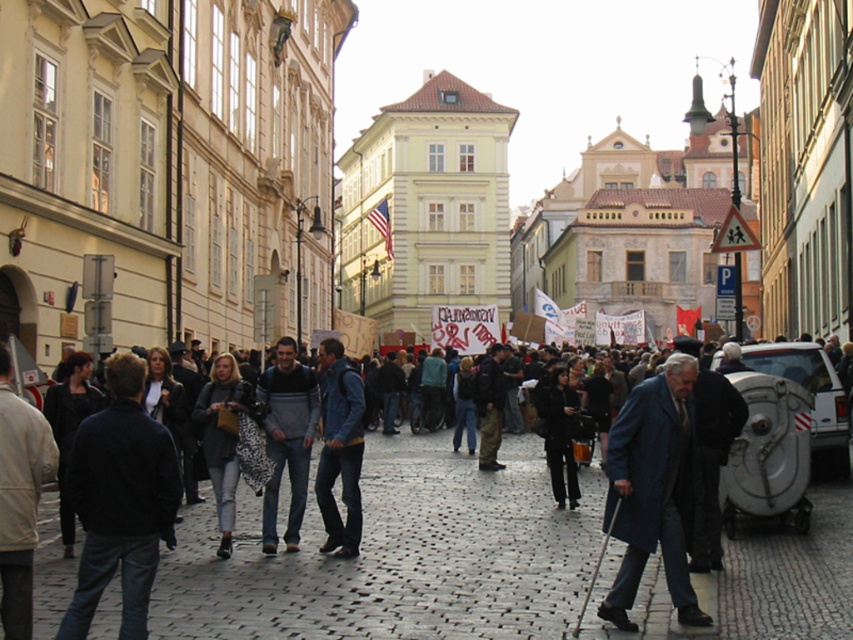
Question: Does knit sweater at center lie in front of leopard print coat at center?

Choices:
 (A) no
 (B) yes

Answer: (A)

Question: Which object appears closest to the camera in this image?

Choices:
 (A) black matte jacket at left
 (B) black fabric coat at center
 (C) cobblestone pavement at center
 (D) denim jacket at center

Answer: (C)

Question: Among these objects, which one is nearest to the camera?

Choices:
 (A) black matte jacket at left
 (B) light beige jacket at left
 (C) denim jacket at center
 (D) black fabric coat at center

Answer: (B)

Question: Does cobblestone pavement at center come in front of black matte jacket at left?

Choices:
 (A) yes
 (B) no

Answer: (A)

Question: Among these points, which one is farthest from the camera?

Choices:
 (A) (96, 573)
 (B) (784, 579)
 (C) (212, 429)
 (D) (4, 525)

Answer: (C)

Question: Does knit sweater at center have a lesser width compared to black fabric coat at center?

Choices:
 (A) no
 (B) yes

Answer: (A)